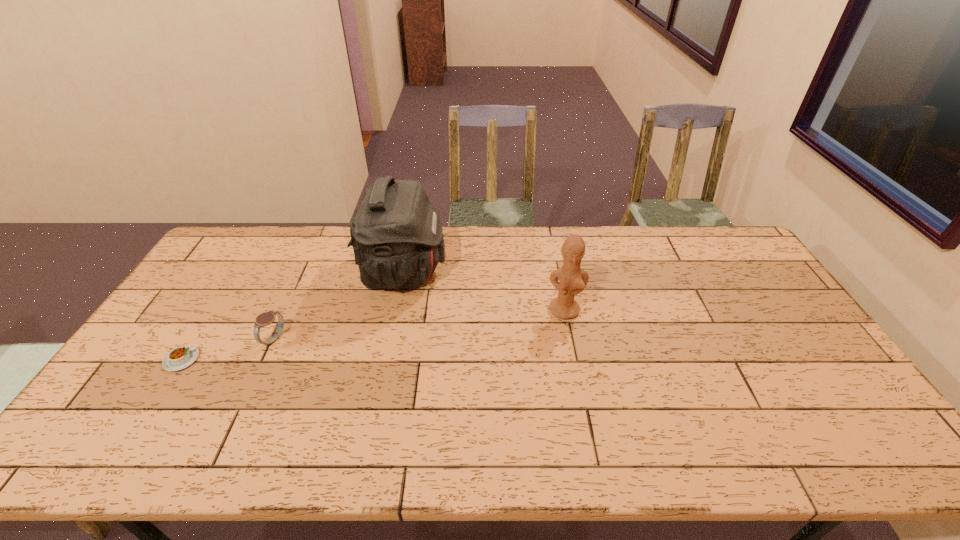
Find the location of a particular element. This screenshot has width=960, height=540. shoulder bag is located at coordinates (397, 237).

At what (x,y) coordinates should I click in order to perform the action: click on the tallest object. Please return your answer as a coordinate pair (x, y). Looking at the image, I should click on (397, 237).

Image resolution: width=960 pixels, height=540 pixels. Find the location of `the second tallest object`. the second tallest object is located at coordinates (572, 279).

Where is `the rightmost object`? Image resolution: width=960 pixels, height=540 pixels. the rightmost object is located at coordinates click(572, 279).

Where is `the third tallest object`? Image resolution: width=960 pixels, height=540 pixels. the third tallest object is located at coordinates tap(264, 319).

The height and width of the screenshot is (540, 960). Find the location of `the third object from right to left`. the third object from right to left is located at coordinates (264, 319).

Locate an element on the screen. This screenshot has height=540, width=960. the shortest object is located at coordinates (181, 357).

At what (x,y) coordinates should I click in order to perform the action: click on pudding. Please return your answer as a coordinate pair (x, y). The height and width of the screenshot is (540, 960). Looking at the image, I should click on (181, 357).

You are a GUI agent. You are given a task and a screenshot of the screen. Output one action in this format:
    pyautogui.click(x=<x>, y=<y>)
    Task: Click on the free spot located on the open flap of the tallest object
    
    Given the screenshot: What is the action you would take?
    pyautogui.click(x=470, y=272)

Find the location of a particular element. free space located 0.170m on the front-facing side of the third shortest object is located at coordinates (576, 367).